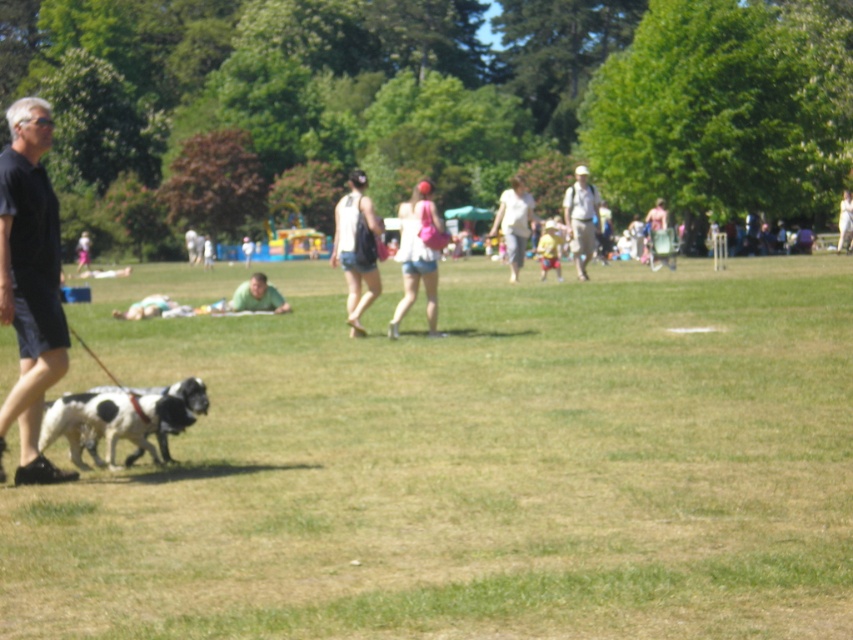
Does point (416, 195) come closer to viewer compared to point (517, 248)?

Yes.

Is pink fabric purse at center below white cotton shirt at center?

Yes.

Is point (433, 212) behind point (502, 228)?

No, it is not.

Image resolution: width=853 pixels, height=640 pixels. I want to click on pink fabric purse at center, so click(416, 257).

Is green grass at lower left shorter than green matte shirt at center?

In fact, green grass at lower left may be taller than green matte shirt at center.

Is green grass at lower left thinner than green matte shirt at center?

In fact, green grass at lower left might be wider than green matte shirt at center.

Is point (694, 428) more distant than point (263, 292)?

No.

This screenshot has height=640, width=853. Identify the location of green grass at lower left. (468, 461).

Is black and white fur dog at lower left further to the viewer compared to green matte shirt at center?

No, black and white fur dog at lower left is in front of green matte shirt at center.

What are the coordinates of `black and white fur dog at lower left` in the screenshot? It's located at (x=120, y=419).

Locate an element on the screen. Image resolution: width=853 pixels, height=640 pixels. black and white fur dog at lower left is located at coordinates (120, 419).

Locate an element on the screen. black and white fur dog at lower left is located at coordinates (120, 419).